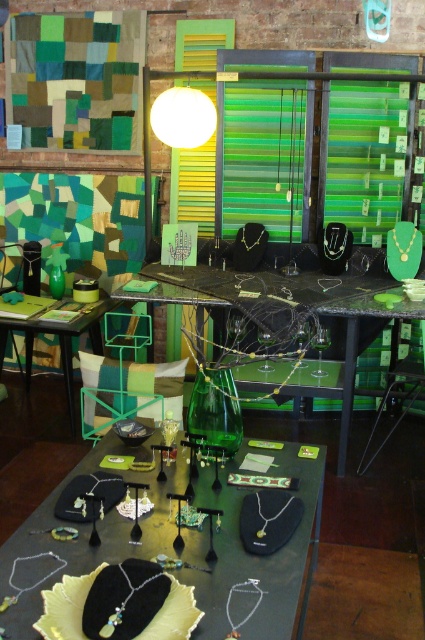
You are standing in front of the jewelry display table. Where is the green fabric pillow at center located on the table?

The green fabric pillow at center is located at point (130, 388) on the table.

You are a customer at the jewelry store looking to view the green glass table at center. Can you easily see the green fabric pillow at center from your current position?

The green fabric pillow at center is below the green glass table at center, so it might be partially or fully obscured by the table, making it difficult to see from above.